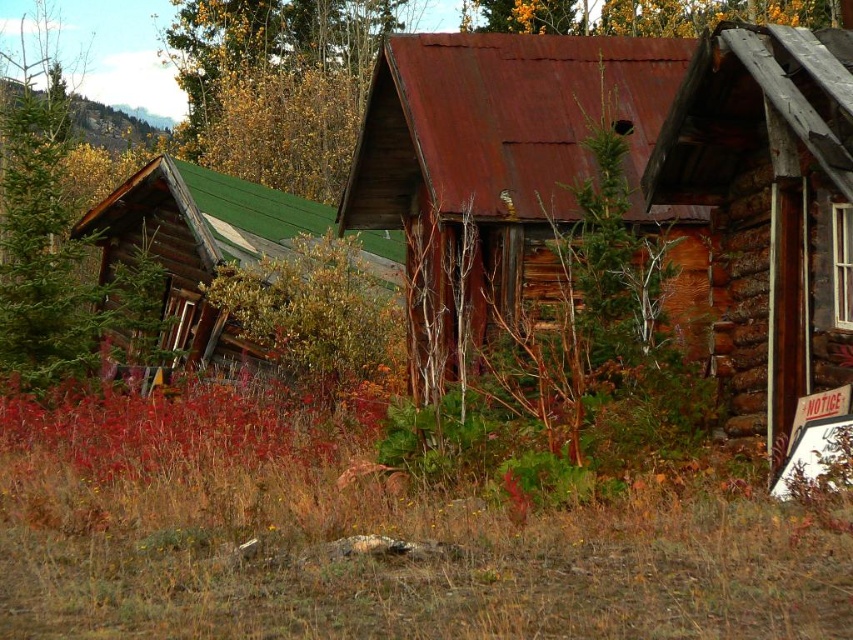
Question: Among these objects, which one is nearest to the camera?

Choices:
 (A) green wood tree at upper left
 (B) weathered wood log cabin at right
 (C) rusty metal hut at center

Answer: (B)

Question: Which point is farther to the camera?

Choices:
 (A) pyautogui.click(x=178, y=172)
 (B) pyautogui.click(x=683, y=115)
 (C) pyautogui.click(x=306, y=86)
 (D) pyautogui.click(x=361, y=195)

Answer: (C)

Question: Can you confirm if rusty metal hut at center is wider than green wood tree at upper left?

Choices:
 (A) yes
 (B) no

Answer: (B)

Question: Does weathered wood log cabin at right appear on the left side of green wood tree at upper left?

Choices:
 (A) yes
 (B) no

Answer: (B)

Question: Which object is farther from the camera taking this photo?

Choices:
 (A) rusty metal hut at center
 (B) green wood tree at upper left
 (C) green wood cabin at left
 (D) weathered wood log cabin at right

Answer: (B)

Question: Does weathered wood log cabin at right appear on the left side of green wood cabin at left?

Choices:
 (A) yes
 (B) no

Answer: (B)